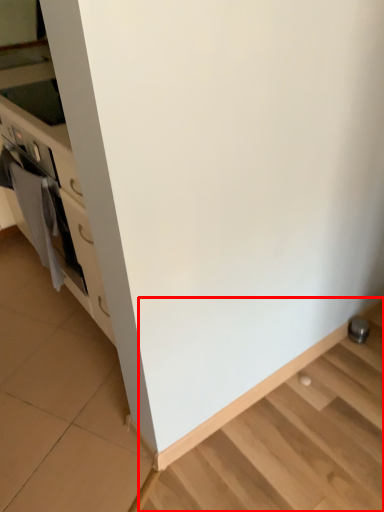
Question: Observing the image, what is the correct spatial positioning of stairwell (annotated by the red box) in reference to material?

Choices:
 (A) right
 (B) left

Answer: (A)